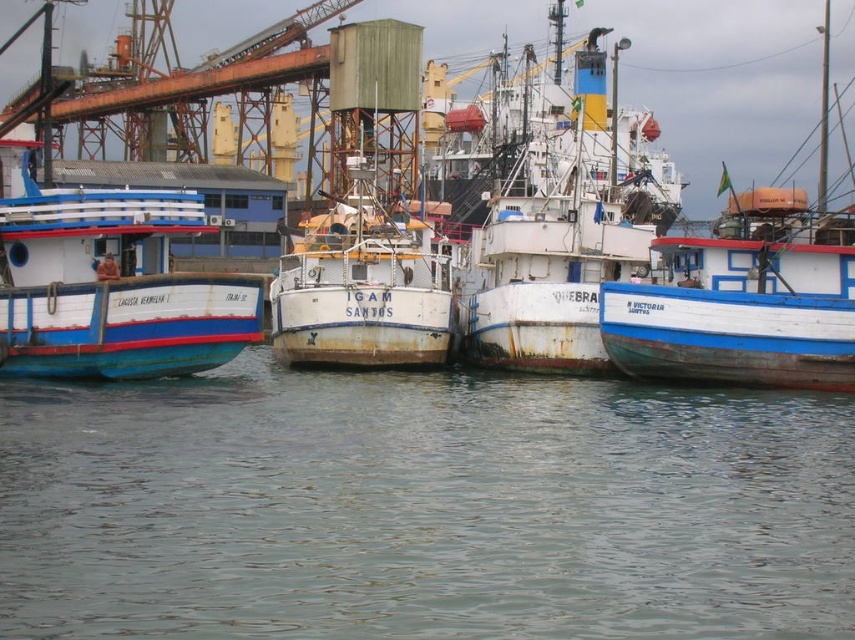
You are standing on the pier looking at the clear water at center and the white weathered ship at center. Which object is nearer to you?

The clear water at center is closer to the viewer than the white weathered ship at center, so the clear water at center is nearer to you.